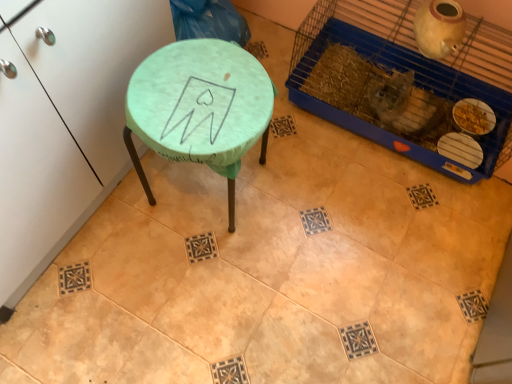
Question: Is point (311, 79) positioned closer to the camera than point (237, 165)?

Choices:
 (A) closer
 (B) farther

Answer: (B)

Question: From a real-world perspective, is blue plastic bird cage at upper right positioned above or below matte green stool at center?

Choices:
 (A) below
 (B) above

Answer: (A)

Question: Which of these objects is positioned farthest from the blue plastic bird cage at upper right?

Choices:
 (A) green fabric-covered stool at upper left
 (B) matte green stool at center

Answer: (A)

Question: Estimate the real-world distances between objects in this image. Which object is farther from the blue plastic bird cage at upper right?

Choices:
 (A) matte green stool at center
 (B) green fabric-covered stool at upper left

Answer: (B)